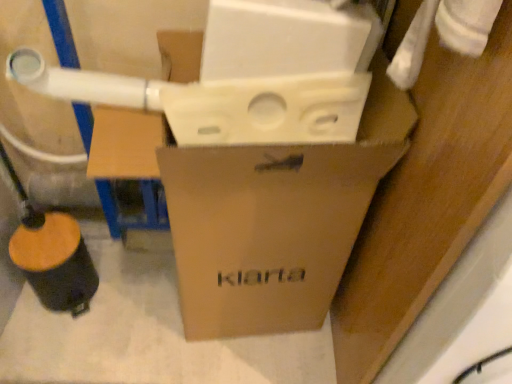
Image resolution: width=512 pixels, height=384 pixels. In order to click on vacant area on top of wooden/textured water pipe at lower left (from a real-world perspective) in this screenshot , I will do `click(46, 247)`.